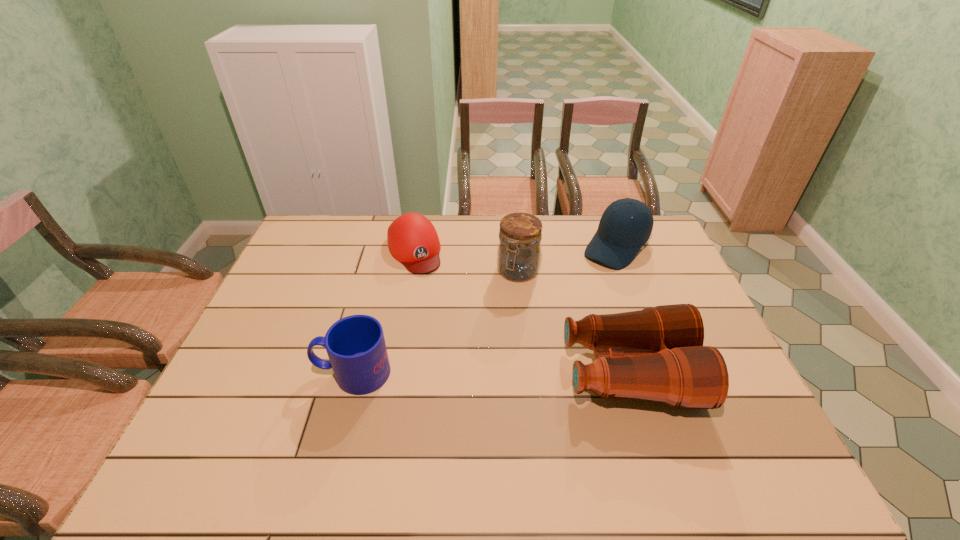
Image resolution: width=960 pixels, height=540 pixels. I want to click on vacant space that satisfies the following two spatial constraints: 1. on the front side of the third object from right to left; 2. through the lenses of the binoculars, so click(x=528, y=373).

At what (x,y) coordinates should I click in order to perform the action: click on vacant area that satisfies the following two spatial constraints: 1. on the back side of the left baseball cap; 2. on the right side of the right baseball cap. Please return your answer as a coordinate pair (x, y). The height and width of the screenshot is (540, 960). Looking at the image, I should click on (415, 247).